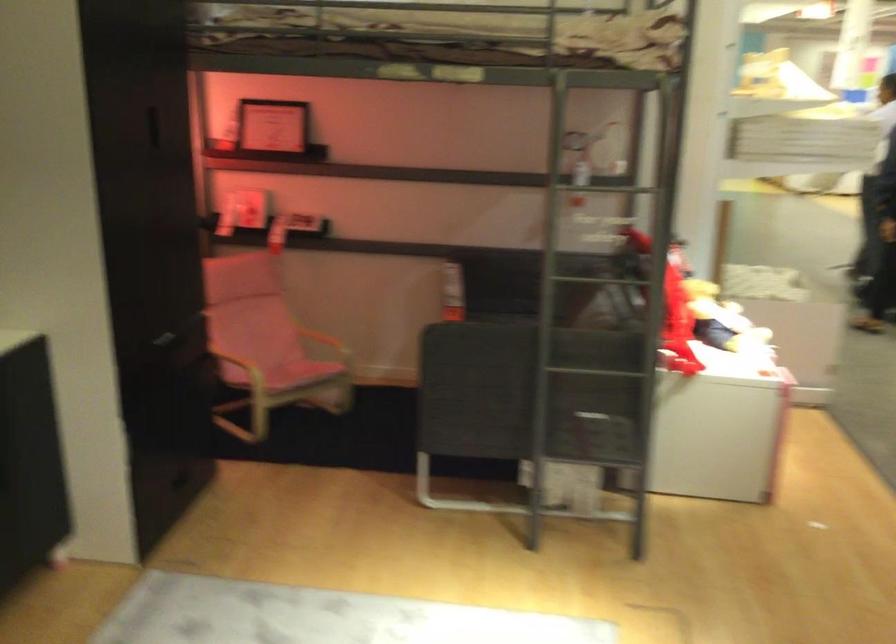
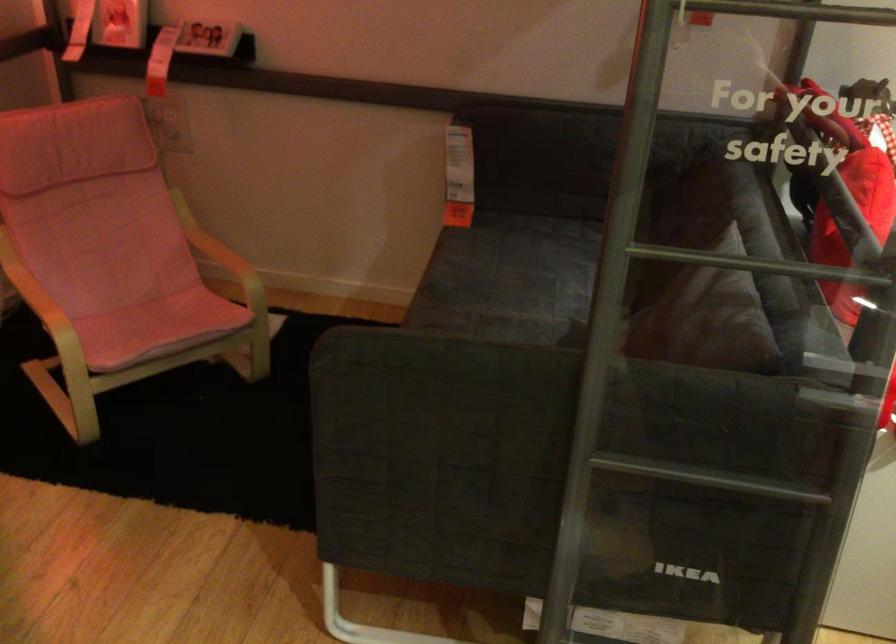
Where in the second image is the point corresponding to [276,368] from the first image?

(126, 307)